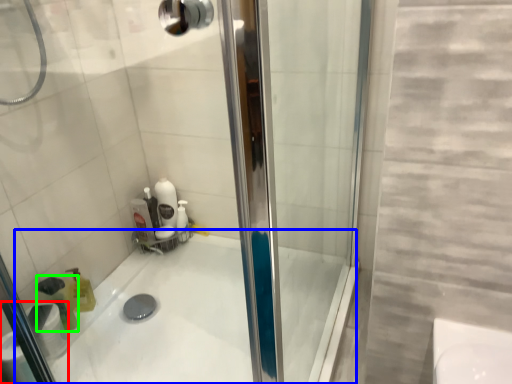
Question: Considering the real-world distances, which object is farthest from toilet paper (highlighted by a red box)? bath (highlighted by a blue box) or cleaning product (highlighted by a green box)?

Choices:
 (A) bath
 (B) cleaning product

Answer: (A)